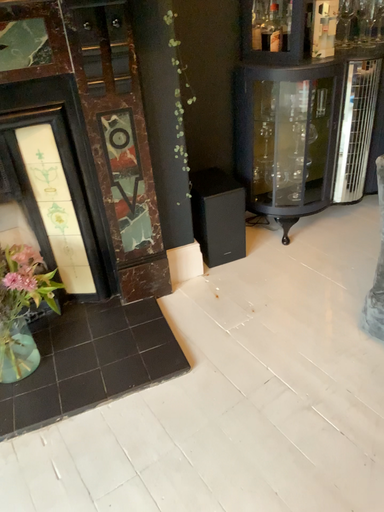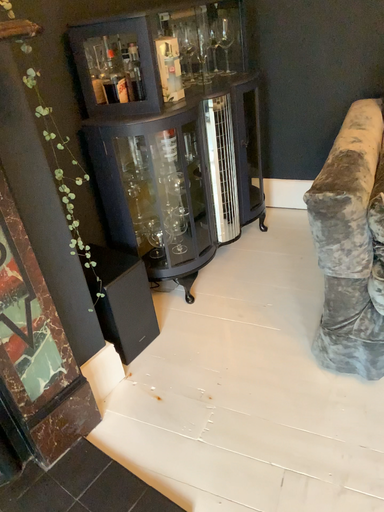
Question: How did the camera likely rotate when shooting the video?

Choices:
 (A) rotated right
 (B) rotated left

Answer: (A)